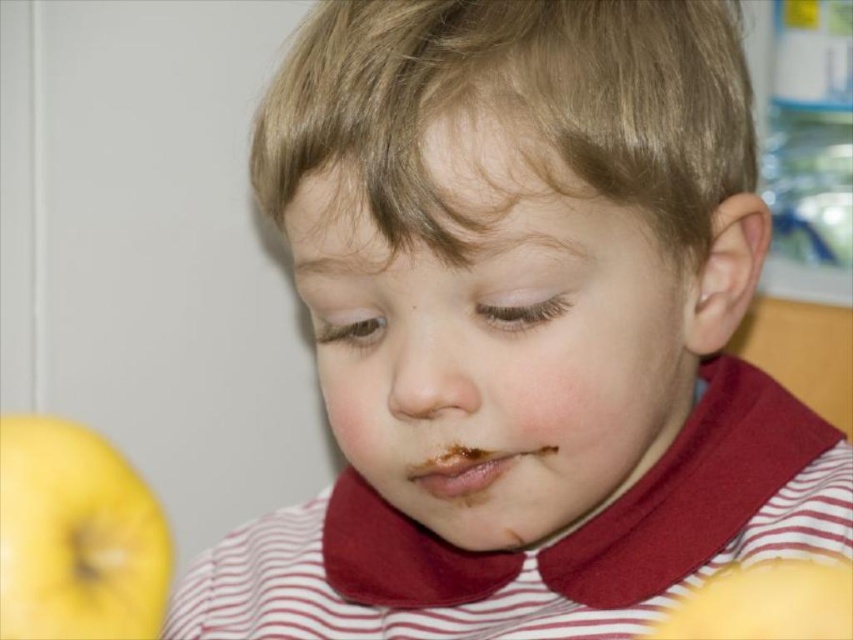
Is smooth skin face at center shorter than yellow matte apple at lower left?

In fact, smooth skin face at center may be taller than yellow matte apple at lower left.

The width and height of the screenshot is (853, 640). Identify the location of smooth skin face at center. (494, 336).